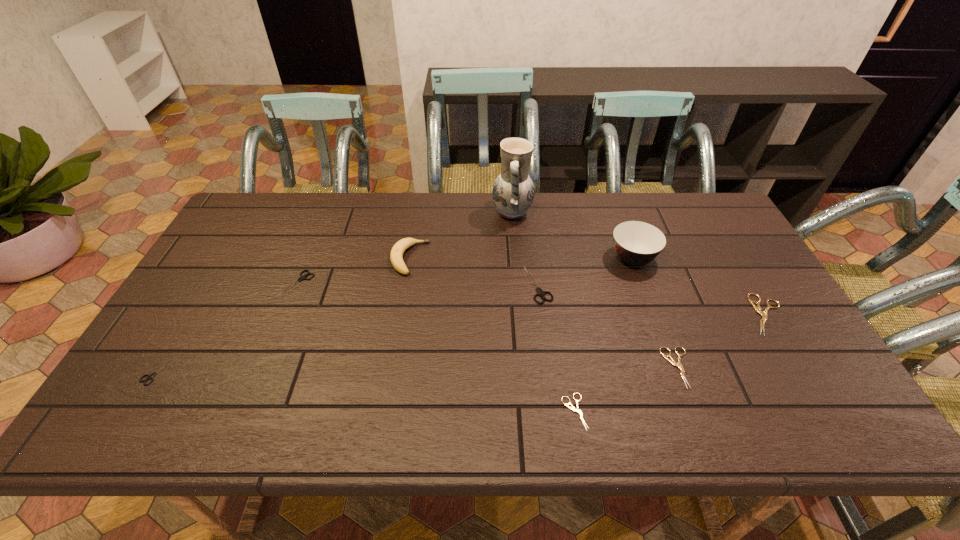
I want to click on the closest black shears to the leftmost beige shears, so click(x=540, y=292).

Identify which black shears is the third closest to the rightmost object. Please provide its 2D coordinates. Your answer should be formatted as a tuple, i.e. [(x, y)], where the tuple contains the x and y coordinates of a point satisfying the conditions above.

[(150, 377)]

Locate an element on the screen. The image size is (960, 540). beige shears that is the second closest one to the second beige shears from right to left is located at coordinates (764, 315).

Where is `beige shears that stands as the third closest to the seventh object from right to left`? Image resolution: width=960 pixels, height=540 pixels. beige shears that stands as the third closest to the seventh object from right to left is located at coordinates (764, 315).

The width and height of the screenshot is (960, 540). I want to click on free region that satisfies the following two spatial constraints: 1. on the back side of the second biggest beige shears; 2. on the left side of the rightmost object, so click(x=659, y=315).

Locate an element on the screen. vacant space that satisfies the following two spatial constraints: 1. on either side of the pottery; 2. on the right side of the shortest object is located at coordinates (529, 411).

Find the location of `vacant space that satisfies the following two spatial constraints: 1. on the front side of the tallest shears; 2. on the right side of the banana`. vacant space that satisfies the following two spatial constraints: 1. on the front side of the tallest shears; 2. on the right side of the banana is located at coordinates (405, 285).

You are a GUI agent. You are given a task and a screenshot of the screen. Output one action in this format:
    pyautogui.click(x=<x>, y=<y>)
    Task: Click on the vacant area that satisfies the following two spatial constraints: 1. on the front side of the eighth shortest object; 2. on the right side of the second shears from right to left
    This screenshot has width=960, height=540.
    Given the screenshot: What is the action you would take?
    pyautogui.click(x=672, y=368)